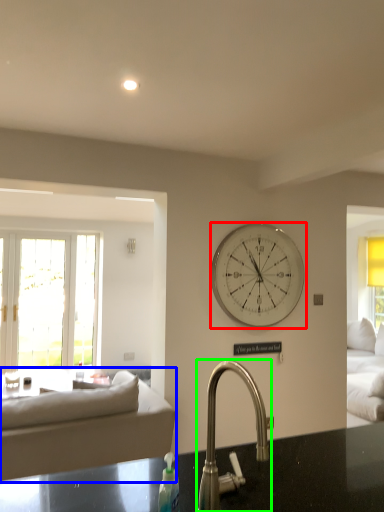
Question: Considering the real-world distances, which object is closest to wall clock (highlighted by a red box)? studio couch (highlighted by a blue box) or tap (highlighted by a green box).

Choices:
 (A) studio couch
 (B) tap

Answer: (A)